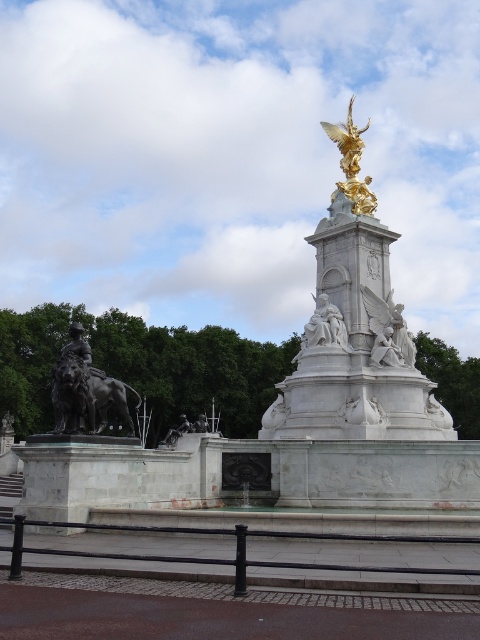
Does gold polished statue at center appear under gold metallic angel at upper center?

Yes, gold polished statue at center is below gold metallic angel at upper center.

Is gold polished statue at center wider than gold metallic angel at upper center?

No.

Does point (381, 256) lie in front of point (371, 179)?

Yes, it is in front of point (371, 179).

You are a GUI agent. You are given a task and a screenshot of the screen. Output one action in this format:
    pyautogui.click(x=<x>, y=<y>)
    Task: Click on the gold polished statue at center
    
    Given the screenshot: What is the action you would take?
    pyautogui.click(x=355, y=332)

Does point (79, 410) come in front of point (372, 196)?

Yes, it is.

Can you confirm if bronze statue at left is smaller than gold metallic angel at upper center?

Correct, bronze statue at left occupies less space than gold metallic angel at upper center.

Which is in front, point (115, 380) or point (358, 202)?

Point (115, 380)

Locate an element on the screen. bronze statue at left is located at coordinates (84, 388).

What do you see at coordinates (84, 388) in the screenshot?
I see `bronze statue at left` at bounding box center [84, 388].

Which of these two, bronze statue at left or white marble angel at lower right, stands taller?

bronze statue at left is taller.

Is point (118, 394) positioned after point (379, 321)?

That is False.

I want to click on bronze statue at left, so click(x=84, y=388).